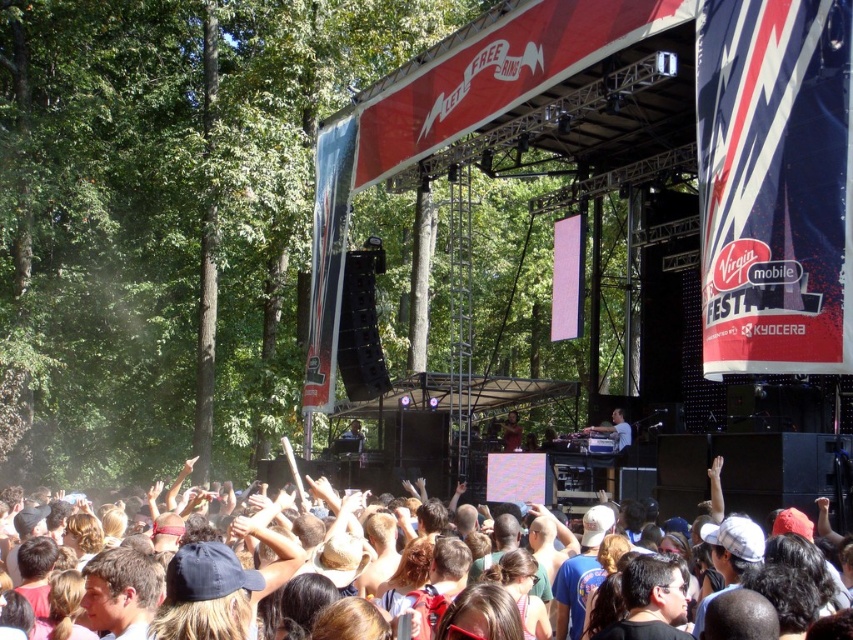
Question: Which object is positioned farthest from the matte black dj booth at center?

Choices:
 (A) multicolored fabric crowd at lower center
 (B) shiny black jacket at center

Answer: (A)

Question: Based on their relative distances, which object is nearer to the shiny black jacket at center?

Choices:
 (A) multicolored fabric crowd at lower center
 (B) matte black dj booth at center

Answer: (B)

Question: Can you confirm if matte black dj booth at center is positioned below shiny black jacket at center?

Choices:
 (A) no
 (B) yes

Answer: (A)

Question: Which point is closer to the camera taking this photo?

Choices:
 (A) (833, 577)
 (B) (590, 432)
 (C) (517, 420)

Answer: (A)

Question: Can you confirm if multicolored fabric crowd at lower center is smaller than shiny black jacket at center?

Choices:
 (A) no
 (B) yes

Answer: (A)

Question: Does matte black dj booth at center have a lesser width compared to shiny black jacket at center?

Choices:
 (A) no
 (B) yes

Answer: (A)